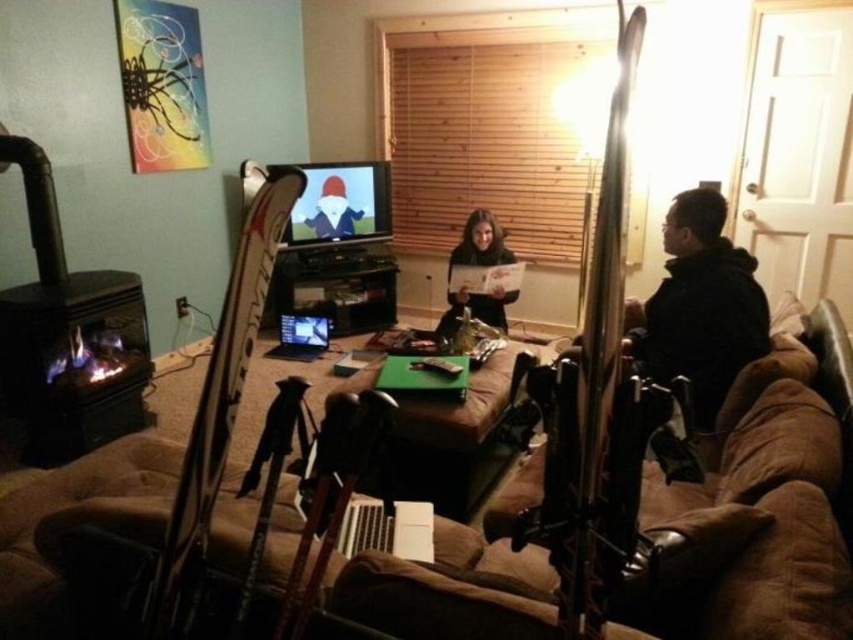
Question: Is dark brown hair at center above silver metallic laptop at center?

Choices:
 (A) no
 (B) yes

Answer: (B)

Question: Which object is farther from the camera taking this photo?

Choices:
 (A) silver metallic laptop at center
 (B) brown fabric couch at center
 (C) dark brown hair at center

Answer: (A)

Question: Considering the relative positions of brown fabric couch at center and silver metallic laptop at center in the image provided, where is brown fabric couch at center located with respect to silver metallic laptop at center?

Choices:
 (A) below
 (B) above

Answer: (A)

Question: Which of the following is the farthest from the observer?

Choices:
 (A) (511, 257)
 (B) (306, 333)

Answer: (B)

Question: Which object is closer to the camera taking this photo?

Choices:
 (A) brown fabric couch at center
 (B) silver metallic laptop at center
 (C) dark brown hair at center

Answer: (A)

Question: Can you confirm if dark brown hair at center is thinner than silver metallic laptop at center?

Choices:
 (A) yes
 (B) no

Answer: (B)